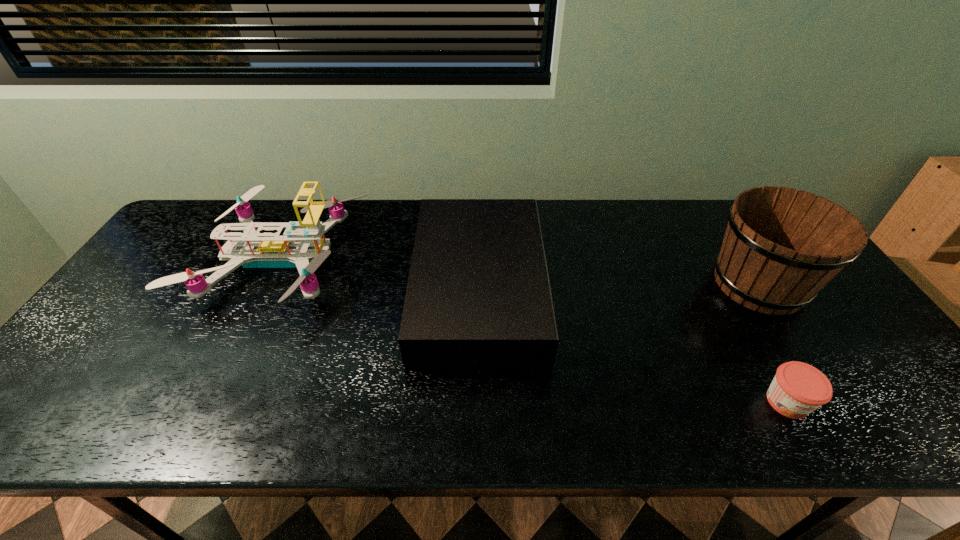
At what (x,y) coordinates should I click in order to perform the action: click on the leftmost object. Please return your answer as a coordinate pair (x, y). Looking at the image, I should click on (296, 247).

Where is `wine bucket`? This screenshot has height=540, width=960. wine bucket is located at coordinates (782, 246).

Find the location of a particular element. CD player is located at coordinates (478, 294).

Locate an element on the screen. This screenshot has height=540, width=960. the second object from left to right is located at coordinates (478, 294).

Locate an element on the screen. The width and height of the screenshot is (960, 540). jam is located at coordinates (797, 389).

Identify the location of the shortest object. The height and width of the screenshot is (540, 960). (797, 389).

Locate an element on the screen. free space located 0.060m on the front-facing side of the leftmost object is located at coordinates (381, 261).

Locate an element on the screen. This screenshot has height=540, width=960. vacant space located 0.060m on the front of the wine bucket is located at coordinates (797, 342).

The image size is (960, 540). I want to click on vacant space located 0.400m at the front of the third tallest object for disc insertion, so click(686, 287).

Identify the location of drone that is at the far edge. (296, 247).